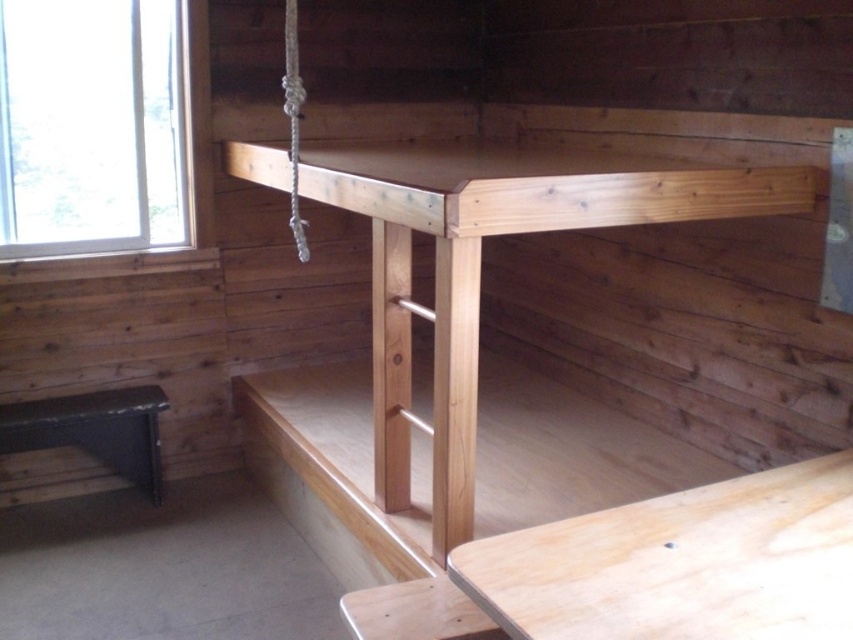
Question: Estimate the real-world distances between objects in this image. Which object is closer to the transparent glass window at upper left?

Choices:
 (A) light wood/texture workbench at center
 (B) natural wood bunk bed at center

Answer: (B)

Question: Does light wood/texture workbench at center appear under black leather bench at lower left?

Choices:
 (A) no
 (B) yes

Answer: (A)

Question: Which object is farther from the camera taking this photo?

Choices:
 (A) natural wood bunk bed at center
 (B) transparent glass window at upper left

Answer: (B)

Question: Based on their relative distances, which object is nearer to the black leather bench at lower left?

Choices:
 (A) light wood/texture workbench at center
 (B) transparent glass window at upper left

Answer: (B)

Question: Does natural wood bunk bed at center have a smaller size compared to black leather bench at lower left?

Choices:
 (A) no
 (B) yes

Answer: (A)

Question: Is light wood/texture workbench at center below transparent glass window at upper left?

Choices:
 (A) yes
 (B) no

Answer: (A)